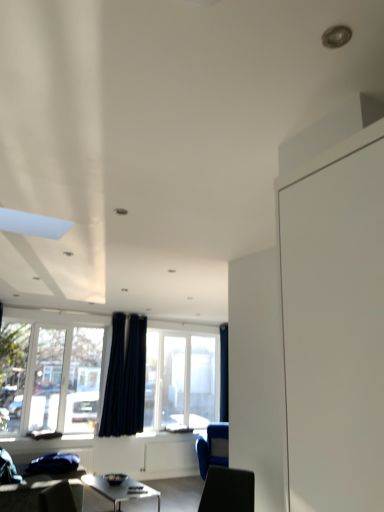
Question: Is blue fabric armchair at lower right in front of dark blue fabric curtain at upper center, the first curtain when ordered from back to front?

Choices:
 (A) yes
 (B) no

Answer: (A)

Question: Considering the relative sizes of blue fabric armchair at lower right and dark blue fabric curtain at upper center, arranged as the second curtain when viewed from the left, in the image provided, is blue fabric armchair at lower right shorter than dark blue fabric curtain at upper center, arranged as the second curtain when viewed from the left,?

Choices:
 (A) yes
 (B) no

Answer: (A)

Question: From a real-world perspective, does blue fabric armchair at lower right sit lower than dark blue fabric curtain at upper center, the 2th curtain in the front-to-back sequence?

Choices:
 (A) yes
 (B) no

Answer: (A)

Question: Could dark blue fabric curtain at upper center, the first curtain in the right-to-left sequence, be considered to be inside blue fabric armchair at lower right?

Choices:
 (A) no
 (B) yes

Answer: (A)

Question: Does blue fabric armchair at lower right come behind dark blue fabric curtain at upper center, arranged as the second curtain when viewed from the left?

Choices:
 (A) no
 (B) yes

Answer: (A)

Question: Considering the positions of blue fabric armchair at lower right and dark blue fabric curtain at upper center, the first curtain when ordered from back to front, in the image, is blue fabric armchair at lower right taller or shorter than dark blue fabric curtain at upper center, the first curtain when ordered from back to front,?

Choices:
 (A) tall
 (B) short

Answer: (B)

Question: Considering the relative positions of blue fabric armchair at lower right and dark blue fabric curtain at upper center, arranged as the second curtain when viewed from the left, in the image provided, is blue fabric armchair at lower right to the left or to the right of dark blue fabric curtain at upper center, arranged as the second curtain when viewed from the left,?

Choices:
 (A) left
 (B) right

Answer: (A)

Question: From a real-world perspective, relative to dark blue fabric curtain at upper center, arranged as the second curtain when viewed from the left, is blue fabric armchair at lower right vertically above or below?

Choices:
 (A) below
 (B) above

Answer: (A)

Question: In the image, is blue fabric armchair at lower right positioned in front of or behind dark blue fabric curtain at upper center, arranged as the second curtain when viewed from the left?

Choices:
 (A) behind
 (B) front

Answer: (B)

Question: Based on their positions, is transparent glass window at center, which appears as the 2th window when viewed from the front, located to the left or right of transparent glass window at lower left, placed as the 2th window when sorted from back to front?

Choices:
 (A) right
 (B) left

Answer: (A)

Question: Considering their positions, is transparent glass window at center, which appears as the first window when viewed from the right, located in front of or behind transparent glass window at lower left, which is the first window in left-to-right order?

Choices:
 (A) front
 (B) behind

Answer: (B)

Question: Is transparent glass window at center, which appears as the first window when viewed from the right, taller or shorter than transparent glass window at lower left, which is the first window in left-to-right order?

Choices:
 (A) tall
 (B) short

Answer: (B)

Question: Considering the positions of transparent glass window at center, which appears as the first window when viewed from the right, and transparent glass window at lower left, acting as the 2th window starting from the right, in the image, is transparent glass window at center, which appears as the first window when viewed from the right, wider or thinner than transparent glass window at lower left, acting as the 2th window starting from the right,?

Choices:
 (A) wide
 (B) thin

Answer: (A)

Question: From a real-world perspective, is dark blue fabric curtain at upper center, arranged as the second curtain when viewed from the left, positioned above or below transparent glass window at lower left, acting as the 2th window starting from the right?

Choices:
 (A) above
 (B) below

Answer: (A)

Question: In terms of height, does dark blue fabric curtain at upper center, the 2th curtain in the front-to-back sequence, look taller or shorter compared to transparent glass window at lower left, placed as the 2th window when sorted from back to front?

Choices:
 (A) short
 (B) tall

Answer: (B)